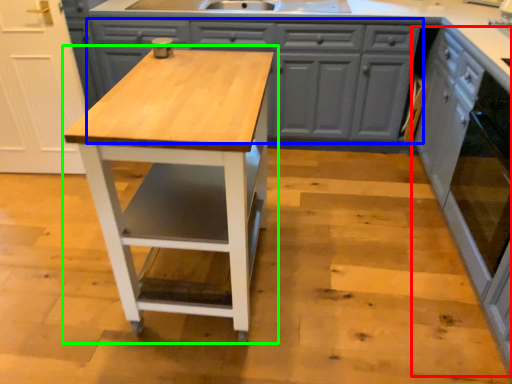
Question: Estimate the real-world distances between objects in this image. Which object is closer to cabinetry (highlighted by a red box), cabinetry (highlighted by a blue box) or table (highlighted by a green box)?

Choices:
 (A) cabinetry
 (B) table

Answer: (A)